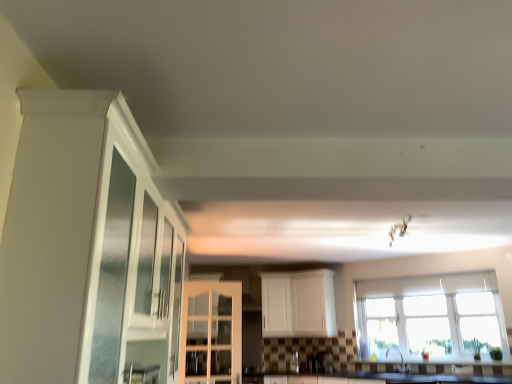
Describe the element at coordinates (211, 331) in the screenshot. I see `white glossy cabinet at center, marked as the second cabinetry in a front-to-back arrangement` at that location.

I want to click on white glossy cabinet at left, acting as the third cabinetry starting from the back, so click(85, 246).

What do you see at coordinates (85, 246) in the screenshot? The height and width of the screenshot is (384, 512). I see `white glossy cabinet at left, positioned as the 1th cabinetry in front-to-back order` at bounding box center [85, 246].

This screenshot has height=384, width=512. I want to click on metallic glass bottle at center, so click(x=294, y=362).

Find the location of a particular element. The height and width of the screenshot is (384, 512). white matte cabinet at center, which is counted as the third cabinetry, starting from the front is located at coordinates (298, 304).

Identify the location of white glossy cabinet at center, marked as the second cabinetry in a front-to-back arrangement. Image resolution: width=512 pixels, height=384 pixels. click(211, 331).

Which of these two, metallic glass bottle at center or clear glass window at center, is smaller?

metallic glass bottle at center.

Considering the positions of objects metallic glass bottle at center and clear glass window at center in the image provided, who is more to the right, metallic glass bottle at center or clear glass window at center?

clear glass window at center is more to the right.

From a real-world perspective, is metallic glass bottle at center located higher than clear glass window at center?

No, from a real-world perspective, metallic glass bottle at center is not on top of clear glass window at center.

Locate an element on the screen. The image size is (512, 384). silver behind the white glossy cabinet at center, the second cabinetry in the back-to-front sequence is located at coordinates (294, 362).

Is metallic glass bottle at center to the right of white glossy cabinet at center, marked as the second cabinetry in a front-to-back arrangement, from the viewer's perspective?

Correct, you'll find metallic glass bottle at center to the right of white glossy cabinet at center, marked as the second cabinetry in a front-to-back arrangement.

Is metallic glass bottle at center surrounding white glossy cabinet at center, the second cabinetry in the back-to-front sequence?

A: No, white glossy cabinet at center, the second cabinetry in the back-to-front sequence, is located outside of metallic glass bottle at center.

Can you confirm if metallic glass bottle at center is bigger than white glossy cabinet at center, marked as the second cabinetry in a front-to-back arrangement?

Actually, metallic glass bottle at center might be smaller than white glossy cabinet at center, marked as the second cabinetry in a front-to-back arrangement.

From the picture: Is white matte cabinet at center, which is counted as the third cabinetry, starting from the front, facing towards white glossy cabinet at left, positioned as the 1th cabinetry in front-to-back order?

Yes, white matte cabinet at center, which is counted as the third cabinetry, starting from the front, is facing white glossy cabinet at left, positioned as the 1th cabinetry in front-to-back order.

Would you say white matte cabinet at center, which is counted as the third cabinetry, starting from the front, is outside white glossy cabinet at left, positioned as the 1th cabinetry in front-to-back order?

white matte cabinet at center, which is counted as the third cabinetry, starting from the front, lies outside white glossy cabinet at left, positioned as the 1th cabinetry in front-to-back order,'s area.

Considering the relative sizes of white matte cabinet at center, which is counted as the third cabinetry, starting from the front, and white glossy cabinet at left, acting as the third cabinetry starting from the back, in the image provided, is white matte cabinet at center, which is counted as the third cabinetry, starting from the front, taller than white glossy cabinet at left, acting as the third cabinetry starting from the back,?

In fact, white matte cabinet at center, which is counted as the third cabinetry, starting from the front, may be shorter than white glossy cabinet at left, acting as the third cabinetry starting from the back.

Does point (268, 293) appear closer or farther from the camera than point (159, 246)?

Point (268, 293) appears to be farther away from the viewer than point (159, 246).

Can you see white glossy cabinet at center, the second cabinetry in the back-to-front sequence, touching satin nickel faucet at lower center?

No, white glossy cabinet at center, the second cabinetry in the back-to-front sequence, is not touching satin nickel faucet at lower center.

Based on the photo, from the image's perspective, is white glossy cabinet at center, marked as the second cabinetry in a front-to-back arrangement, on top of satin nickel faucet at lower center?

Yes, from the image's perspective, white glossy cabinet at center, marked as the second cabinetry in a front-to-back arrangement, is on top of satin nickel faucet at lower center.

Based on their positions, is white glossy cabinet at center, the second cabinetry in the back-to-front sequence, located to the left or right of satin nickel faucet at lower center?

Based on their positions, white glossy cabinet at center, the second cabinetry in the back-to-front sequence, is located to the left of satin nickel faucet at lower center.

Is satin nickel faucet at lower center aimed at metallic glass bottle at center?

A: No, satin nickel faucet at lower center is not aimed at metallic glass bottle at center.

Is satin nickel faucet at lower center wider or thinner than metallic glass bottle at center?

satin nickel faucet at lower center is thinner than metallic glass bottle at center.

Is satin nickel faucet at lower center smaller than metallic glass bottle at center?

Actually, satin nickel faucet at lower center might be larger than metallic glass bottle at center.

Would you say white matte cabinet at center, which is counted as the third cabinetry, starting from the front, is inside or outside clear glass window at center?

white matte cabinet at center, which is counted as the third cabinetry, starting from the front, is not enclosed by clear glass window at center.

From a real-world perspective, is white matte cabinet at center, which is counted as the third cabinetry, starting from the front, physically below clear glass window at center?

Incorrect, from a real-world perspective, white matte cabinet at center, which is counted as the third cabinetry, starting from the front, is higher than clear glass window at center.

Is white matte cabinet at center, which is counted as the 1th cabinetry, starting from the back, facing away from clear glass window at center?

No, white matte cabinet at center, which is counted as the 1th cabinetry, starting from the back, is not facing away from clear glass window at center.

Considering the sizes of white matte cabinet at center, which is counted as the third cabinetry, starting from the front, and clear glass window at center in the image, is white matte cabinet at center, which is counted as the third cabinetry, starting from the front, wider or thinner than clear glass window at center?

white matte cabinet at center, which is counted as the third cabinetry, starting from the front, is wider than clear glass window at center.

How much distance is there between clear glass window at center and white glossy cabinet at center, marked as the second cabinetry in a front-to-back arrangement?

clear glass window at center is 8.01 feet from white glossy cabinet at center, marked as the second cabinetry in a front-to-back arrangement.

Considering the positions of objects clear glass window at center and white glossy cabinet at center, marked as the second cabinetry in a front-to-back arrangement, in the image provided, who is more to the right, clear glass window at center or white glossy cabinet at center, marked as the second cabinetry in a front-to-back arrangement,?

clear glass window at center.

Between point (430, 309) and point (207, 353), which one is positioned in front?

The point (207, 353) is closer to the camera.

From the image's perspective, between clear glass window at center and white glossy cabinet at center, the second cabinetry in the back-to-front sequence, which one is located above?

clear glass window at center appears higher in the image.

At what (x,y) coordinates should I click in order to perform the action: click on window in front of the metallic glass bottle at center. Please return your answer as a coordinate pair (x, y). Looking at the image, I should click on (430, 314).

Identify the location of silver behind the white glossy cabinet at center, marked as the second cabinetry in a front-to-back arrangement. pyautogui.click(x=294, y=362).

When comparing their distances from white glossy cabinet at left, acting as the third cabinetry starting from the back, does white matte cabinet at center, which is counted as the third cabinetry, starting from the front, or clear glass window at center seem further?

clear glass window at center.

Based on their spatial positions, is white glossy cabinet at center, marked as the second cabinetry in a front-to-back arrangement, or clear glass window at center further from satin nickel faucet at lower center?

Based on the image, white glossy cabinet at center, marked as the second cabinetry in a front-to-back arrangement, appears to be further to satin nickel faucet at lower center.

Based on their spatial positions, is satin nickel faucet at lower center or white glossy cabinet at center, marked as the second cabinetry in a front-to-back arrangement, closer to clear glass window at center?

satin nickel faucet at lower center.

Consider the image. Looking at the image, which one is located further to white glossy cabinet at center, marked as the second cabinetry in a front-to-back arrangement, metallic glass bottle at center or clear glass window at center?

A: The object further to white glossy cabinet at center, marked as the second cabinetry in a front-to-back arrangement, is clear glass window at center.

Consider the image. From the image, which object appears to be farther from white glossy cabinet at center, marked as the second cabinetry in a front-to-back arrangement, white glossy cabinet at left, acting as the third cabinetry starting from the back, or metallic glass bottle at center?

white glossy cabinet at left, acting as the third cabinetry starting from the back, is further to white glossy cabinet at center, marked as the second cabinetry in a front-to-back arrangement.

Considering their positions, is satin nickel faucet at lower center positioned further to white matte cabinet at center, which is counted as the third cabinetry, starting from the front, than white glossy cabinet at center, the second cabinetry in the back-to-front sequence?

Among the two, satin nickel faucet at lower center is located further to white matte cabinet at center, which is counted as the third cabinetry, starting from the front.

Looking at the image, which one is located further to white glossy cabinet at center, marked as the second cabinetry in a front-to-back arrangement, white matte cabinet at center, which is counted as the 1th cabinetry, starting from the back, or satin nickel faucet at lower center?

Based on the image, satin nickel faucet at lower center appears to be further to white glossy cabinet at center, marked as the second cabinetry in a front-to-back arrangement.

Looking at the image, which one is located further to satin nickel faucet at lower center, white glossy cabinet at center, marked as the second cabinetry in a front-to-back arrangement, or white matte cabinet at center, which is counted as the third cabinetry, starting from the front?

white glossy cabinet at center, marked as the second cabinetry in a front-to-back arrangement.

This screenshot has height=384, width=512. Identify the location of cabinetry between white glossy cabinet at center, marked as the second cabinetry in a front-to-back arrangement, and metallic glass bottle at center. (298, 304).

Where is `cabinetry located between white glossy cabinet at center, the second cabinetry in the back-to-front sequence, and satin nickel faucet at lower center in the left-right direction`? Image resolution: width=512 pixels, height=384 pixels. cabinetry located between white glossy cabinet at center, the second cabinetry in the back-to-front sequence, and satin nickel faucet at lower center in the left-right direction is located at coordinates (298, 304).

Locate an element on the screen. window positioned between white glossy cabinet at left, acting as the third cabinetry starting from the back, and metallic glass bottle at center from near to far is located at coordinates (430, 314).

At what (x,y) coordinates should I click in order to perform the action: click on cabinetry located between white glossy cabinet at center, the second cabinetry in the back-to-front sequence, and clear glass window at center in the left-right direction. Please return your answer as a coordinate pair (x, y). The image size is (512, 384). Looking at the image, I should click on (298, 304).